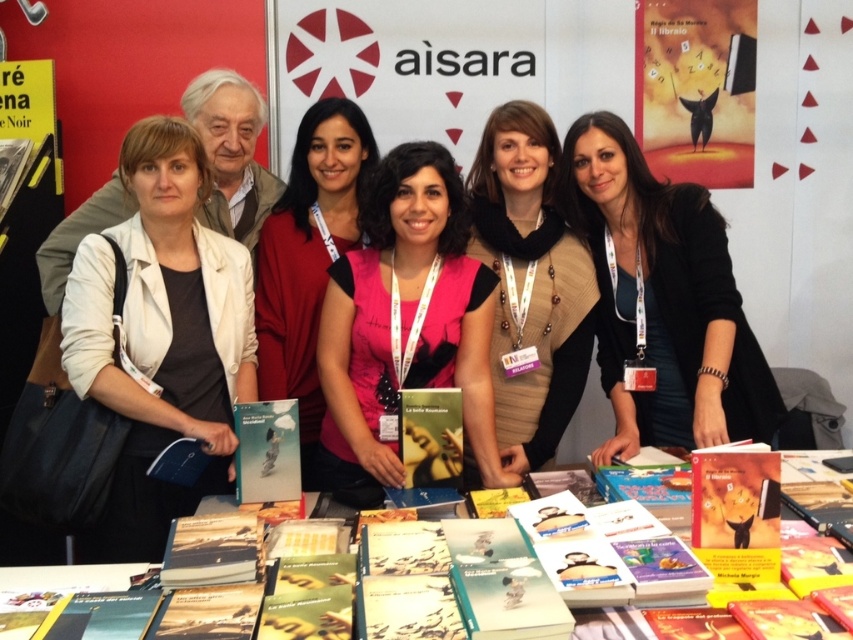
Who is taller, knitted beige sweater at center or pink fabric at center?

With more height is pink fabric at center.

Is point (554, 317) closer to viewer compared to point (355, 163)?

That is True.

Where is `knitted beige sweater at center`? The width and height of the screenshot is (853, 640). knitted beige sweater at center is located at coordinates (531, 284).

The width and height of the screenshot is (853, 640). What are the coordinates of `pink fabric at center` in the screenshot? It's located at point(308,257).

Who is shorter, pink fabric at center or matte yellow book at center?

matte yellow book at center

Is point (305, 253) farther from camera compared to point (746, 484)?

Yes, point (305, 253) is farther from viewer.

The height and width of the screenshot is (640, 853). In order to click on pink fabric at center in this screenshot , I will do `click(308, 257)`.

Who is lower down, pink fabric at center or hardcover book at center?

Positioned lower is hardcover book at center.

Which is above, pink fabric at center or hardcover book at center?

pink fabric at center

Does point (355, 140) lie in front of point (242, 436)?

No.

Locate an element on the screen. pink fabric at center is located at coordinates (308, 257).